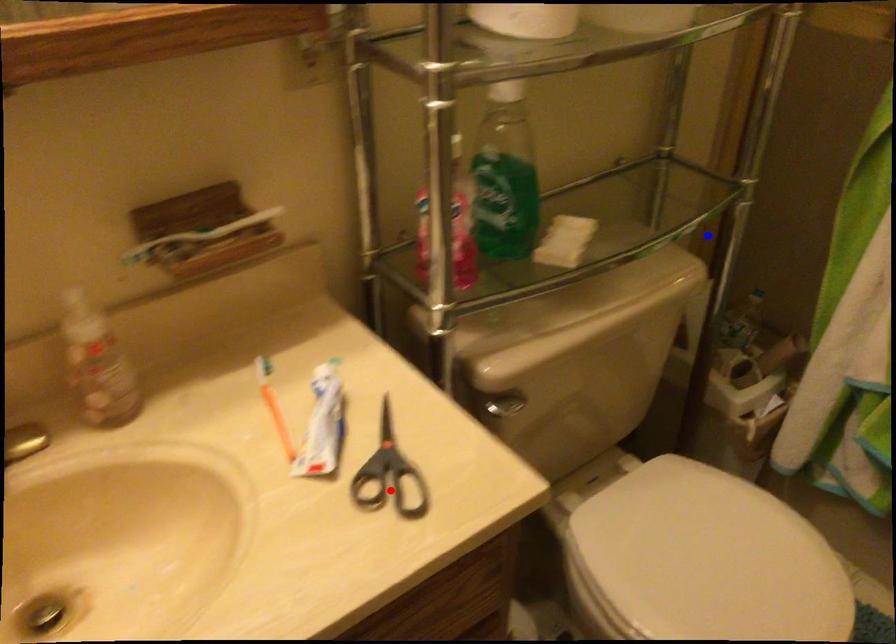
Question: Two points are marked on the image. Which point is closer to the camera?

Choices:
 (A) Blue point is closer.
 (B) Red point is closer.

Answer: (B)